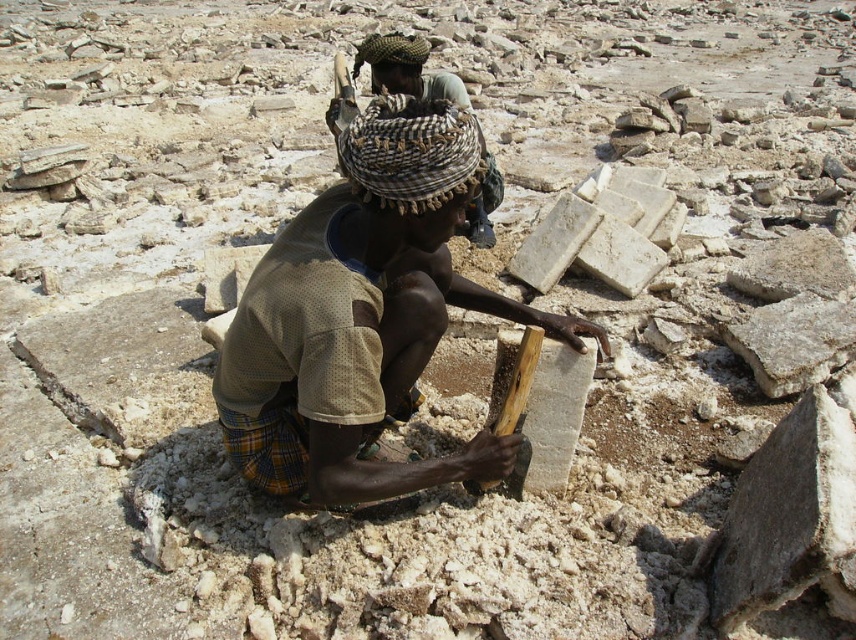
You are a safety inspector in the salt mine. You notice the brown wood at center and the brown woven scarf at center. Which object is closer to the ground?

The brown wood at center is positioned under brown woven scarf at center, so the brown wood at center is closer to the ground.